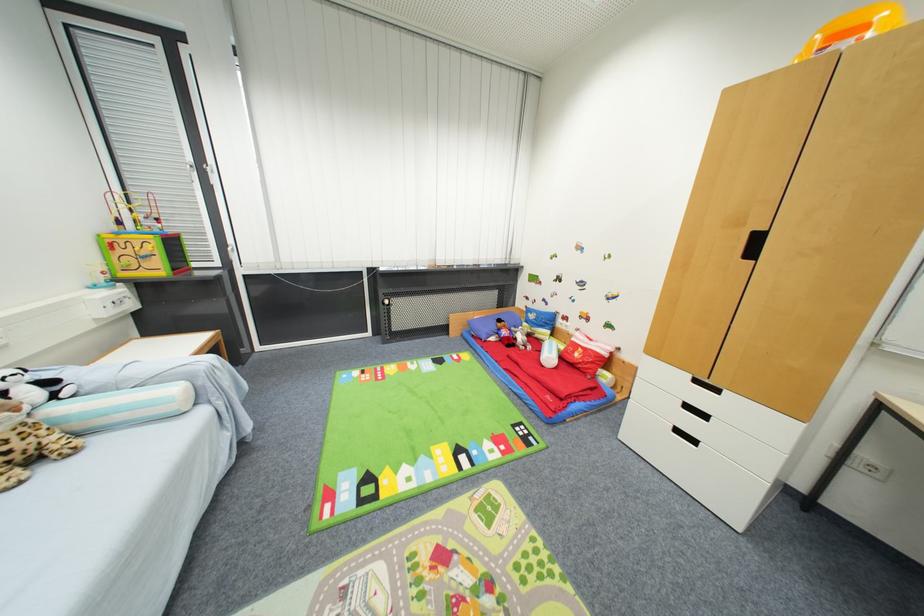
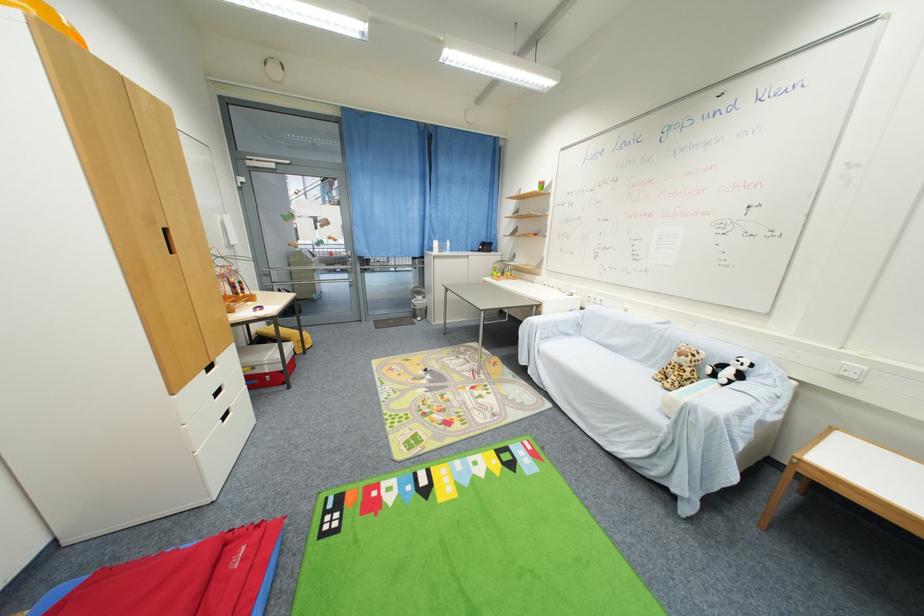
Locate, in the second image, the point that corresponds to [62,448] in the first image.

(675, 382)